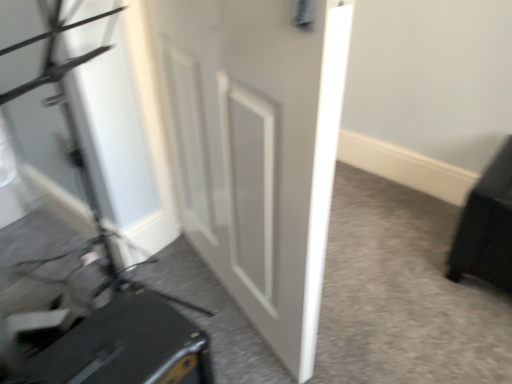
Question: Is white matte door at center taller than matte black suitcase at lower left?

Choices:
 (A) no
 (B) yes

Answer: (B)

Question: Is white matte door at center completely or partially outside of matte black suitcase at lower left?

Choices:
 (A) no
 (B) yes

Answer: (B)

Question: Does white matte door at center contain matte black suitcase at lower left?

Choices:
 (A) no
 (B) yes

Answer: (A)

Question: Can you confirm if white matte door at center is shorter than matte black suitcase at lower left?

Choices:
 (A) no
 (B) yes

Answer: (A)

Question: From the image's perspective, is white matte door at center beneath matte black suitcase at lower left?

Choices:
 (A) no
 (B) yes

Answer: (A)

Question: Looking at their shapes, would you say black matte suitcase at lower left is wider or thinner than matte black suitcase at lower left?

Choices:
 (A) thin
 (B) wide

Answer: (B)

Question: Is black matte suitcase at lower left inside or outside of matte black suitcase at lower left?

Choices:
 (A) inside
 (B) outside

Answer: (B)

Question: Considering the positions of point (130, 344) and point (189, 327), is point (130, 344) closer or farther from the camera than point (189, 327)?

Choices:
 (A) closer
 (B) farther

Answer: (A)

Question: In the image, is black matte suitcase at lower left on the left side or the right side of matte black suitcase at lower left?

Choices:
 (A) right
 (B) left

Answer: (B)

Question: From a real-world perspective, is matte black suitcase at lower left above or below black matte suitcase at lower left?

Choices:
 (A) below
 (B) above

Answer: (A)

Question: Considering the relative positions of matte black suitcase at lower left and black matte suitcase at lower left in the image provided, is matte black suitcase at lower left to the left or to the right of black matte suitcase at lower left?

Choices:
 (A) left
 (B) right

Answer: (B)

Question: Does point (120, 377) appear closer or farther from the camera than point (78, 380)?

Choices:
 (A) closer
 (B) farther

Answer: (B)

Question: From the image's perspective, is matte black suitcase at lower left located above or below black matte suitcase at lower left?

Choices:
 (A) above
 (B) below

Answer: (B)

Question: Based on their positions, is white matte door at center located to the left or right of matte black suitcase at lower left?

Choices:
 (A) left
 (B) right

Answer: (B)

Question: From the image's perspective, is white matte door at center above or below matte black suitcase at lower left?

Choices:
 (A) below
 (B) above

Answer: (B)